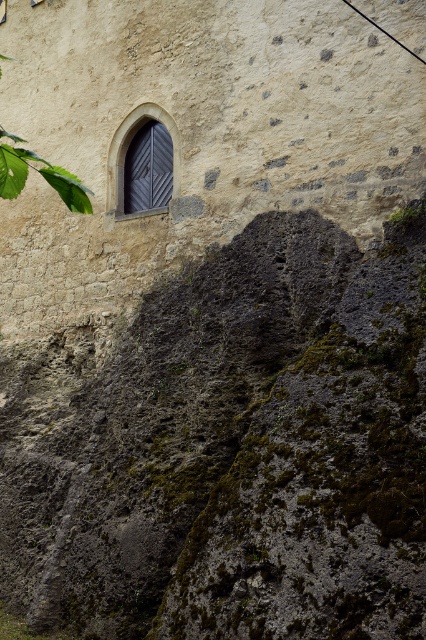
From the picture: You are an architect evaluating the structural integrity of the building. You notice the green leafy tree at upper left and the dark gray wood door at upper left. Which object has a greater width according to the scene?

The green leafy tree at upper left has a greater width than the dark gray wood door at upper left.

You are standing in front of the stone wall and see a point marked at coordinates (43, 176). Based on the scene description, can you determine what this point is located on?

The point at coordinates (43, 176) is on the green leafy tree at upper left.